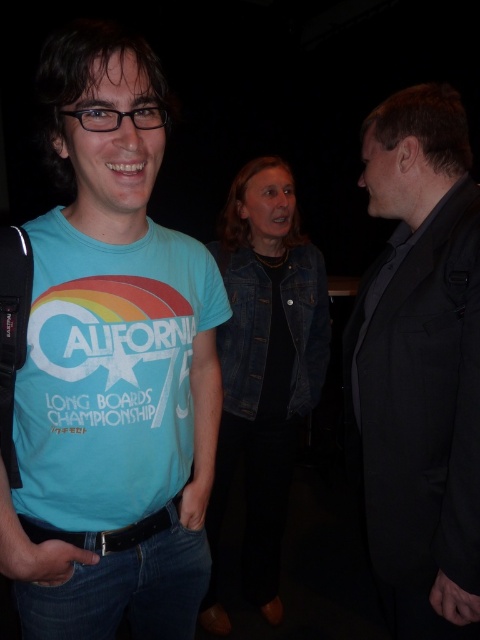
I want to click on matte blue t-shirt at left, so click(x=107, y=365).

Does matte blue t-shirt at left have a lesser width compared to black smooth suit at right?

Incorrect, matte blue t-shirt at left's width is not less than black smooth suit at right's.

Image resolution: width=480 pixels, height=640 pixels. Describe the element at coordinates (107, 365) in the screenshot. I see `matte blue t-shirt at left` at that location.

Locate an element on the screen. This screenshot has width=480, height=640. matte blue t-shirt at left is located at coordinates (107, 365).

Does matte blue t-shirt at left appear under denim jacket at center?

Actually, matte blue t-shirt at left is above denim jacket at center.

Does matte blue t-shirt at left have a smaller size compared to denim jacket at center?

Yes, matte blue t-shirt at left is smaller than denim jacket at center.

Who is more forward, (x=13, y=513) or (x=224, y=616)?

Point (x=13, y=513) is in front.

At what (x,y) coordinates should I click in order to perform the action: click on matte blue t-shirt at left. Please return your answer as a coordinate pair (x, y). The height and width of the screenshot is (640, 480). Looking at the image, I should click on (107, 365).

Is black smooth suit at right positioned behind denim jacket at center?

That is False.

Is black smooth suit at right closer to camera compared to denim jacket at center?

Yes.

Which is behind, point (393, 186) or point (297, 214)?

The point (297, 214) is behind.

Locate an element on the screen. black smooth suit at right is located at coordinates (420, 365).